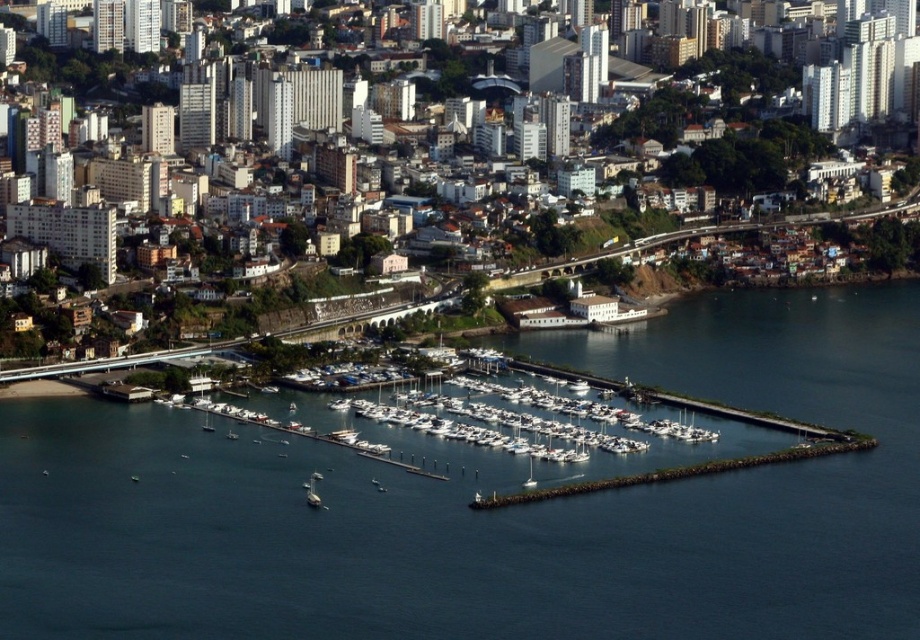
Question: Is dark blue water at center further to the viewer compared to white matte boat at lower center?

Choices:
 (A) yes
 (B) no

Answer: (B)

Question: Is dark blue water at center below white matte boats at center?

Choices:
 (A) yes
 (B) no

Answer: (A)

Question: Can you confirm if dark blue water at center is positioned above white matte boats at center?

Choices:
 (A) no
 (B) yes

Answer: (A)

Question: Which point is closer to the camera?

Choices:
 (A) white matte boats at center
 (B) dark blue water at center

Answer: (B)

Question: Among these objects, which one is nearest to the camera?

Choices:
 (A) white matte boats at center
 (B) white matte boat at lower center

Answer: (B)

Question: Estimate the real-world distances between objects in this image. Which object is farther from the white matte boats at center?

Choices:
 (A) dark blue water at center
 (B) white matte boat at lower center

Answer: (B)